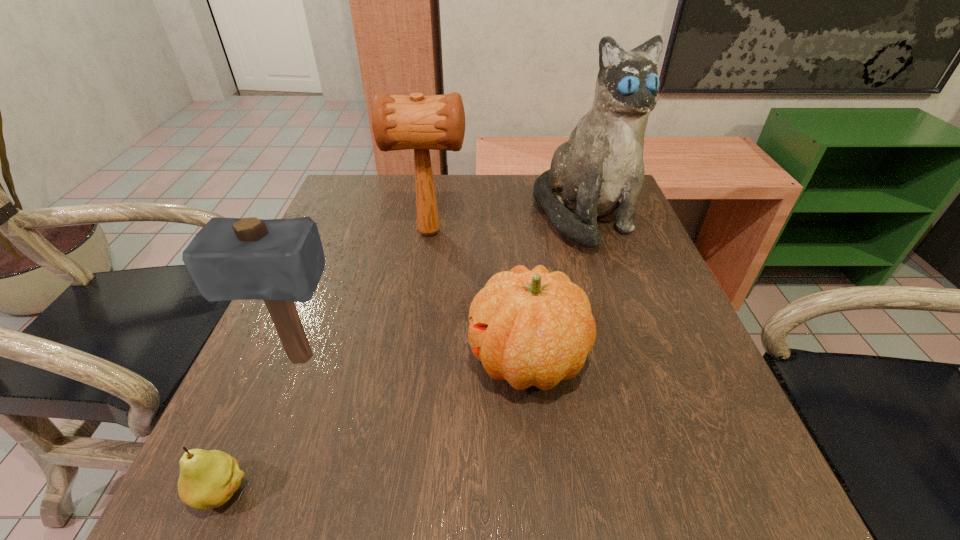
Find the location of a particular element. the tallest object is located at coordinates (599, 170).

I want to click on the third object from left to right, so click(437, 122).

This screenshot has height=540, width=960. What are the coordinates of `the farther mallet` in the screenshot? It's located at (437, 122).

This screenshot has height=540, width=960. I want to click on the nearer mallet, so click(280, 261).

Find the location of `the fourth tallest object`. the fourth tallest object is located at coordinates [531, 328].

Find the location of a particular element. the nearest object is located at coordinates (208, 479).

What are the coordinates of `the shortest object` in the screenshot? It's located at (208, 479).

The height and width of the screenshot is (540, 960). In order to click on free space located 0.100m at the face of the cat in this screenshot , I will do `click(607, 288)`.

Locate an element on the screen. free region located 0.350m on the strike surface of the right mallet is located at coordinates (610, 232).

This screenshot has width=960, height=540. I want to click on vacant space located 0.220m on the back of the nearer mallet, so click(336, 264).